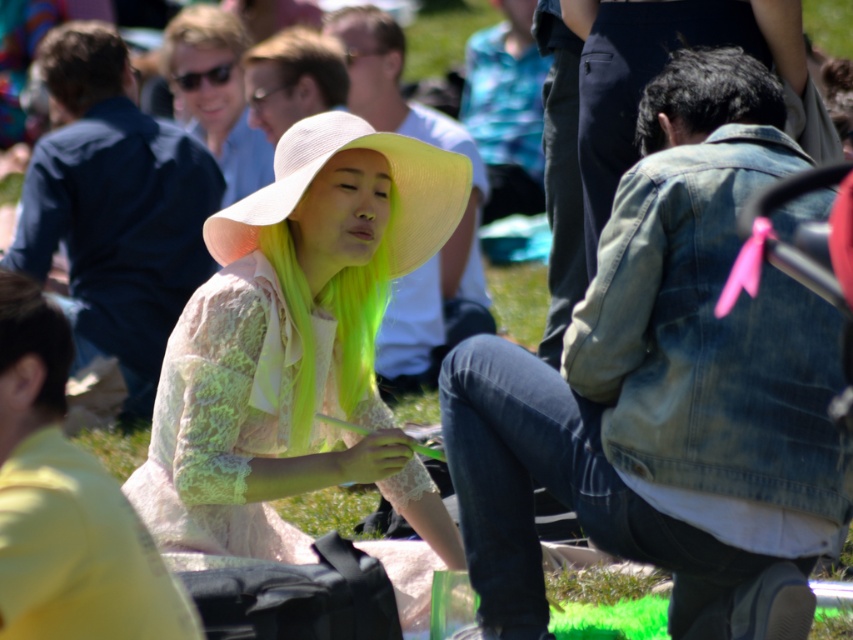
You are taking a photo of the two points in the scene. Which point, point (311, 356) or point (254, 205), will appear larger in your photo?

Point (311, 356) is closer to the camera than point (254, 205), so it will appear larger in the photo.